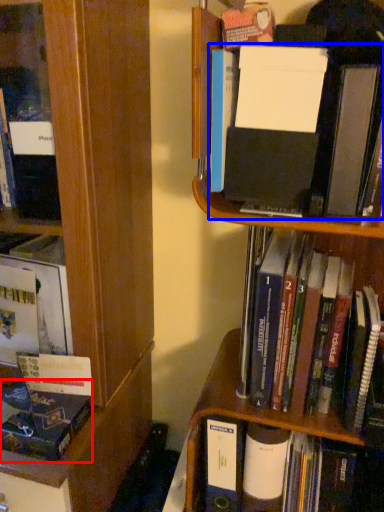
Question: Which of the following is the closest to the observer, book (highlighted by a red box) or book (highlighted by a blue box)?

Choices:
 (A) book
 (B) book

Answer: (B)